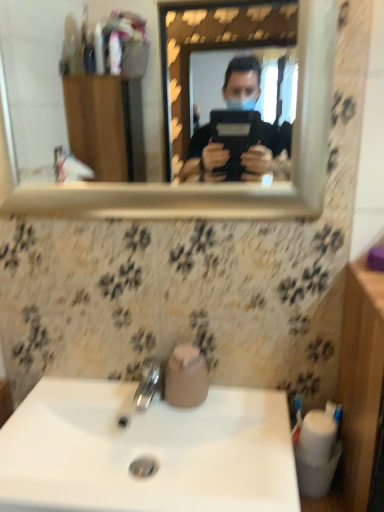
Question: Can you confirm if gold-framed mirror at upper center is smaller than pink matte toilet paper at sink?

Choices:
 (A) yes
 (B) no

Answer: (B)

Question: Can you confirm if gold-framed mirror at upper center is taller than pink matte toilet paper at sink?

Choices:
 (A) yes
 (B) no

Answer: (A)

Question: Is gold-framed mirror at upper center aimed at pink matte toilet paper at sink?

Choices:
 (A) yes
 (B) no

Answer: (B)

Question: From the image's perspective, is gold-framed mirror at upper center beneath pink matte toilet paper at sink?

Choices:
 (A) no
 (B) yes

Answer: (A)

Question: Does gold-framed mirror at upper center have a lesser width compared to pink matte toilet paper at sink?

Choices:
 (A) yes
 (B) no

Answer: (A)

Question: Is polished chrome tap at center in front of or behind gold-framed mirror at upper center in the image?

Choices:
 (A) front
 (B) behind

Answer: (B)

Question: Looking at the image, does polished chrome tap at center seem bigger or smaller compared to gold-framed mirror at upper center?

Choices:
 (A) big
 (B) small

Answer: (B)

Question: Which is correct: polished chrome tap at center is inside gold-framed mirror at upper center, or outside of it?

Choices:
 (A) inside
 (B) outside

Answer: (B)

Question: Based on their positions, is polished chrome tap at center located to the left or right of gold-framed mirror at upper center?

Choices:
 (A) right
 (B) left

Answer: (B)

Question: Considering the positions of point (44, 48) and point (187, 395), is point (44, 48) closer or farther from the camera than point (187, 395)?

Choices:
 (A) closer
 (B) farther

Answer: (B)

Question: Is gold-framed mirror at upper center bigger or smaller than pink matte toilet paper at sink?

Choices:
 (A) small
 (B) big

Answer: (B)

Question: In the image, is gold-framed mirror at upper center on the left side or the right side of pink matte toilet paper at sink?

Choices:
 (A) right
 (B) left

Answer: (B)

Question: From their relative heights in the image, would you say gold-framed mirror at upper center is taller or shorter than pink matte toilet paper at sink?

Choices:
 (A) tall
 (B) short

Answer: (A)

Question: Is white glossy sink at lower center to the left or to the right of polished chrome tap at center in the image?

Choices:
 (A) right
 (B) left

Answer: (A)

Question: From the image's perspective, is white glossy sink at lower center located above or below polished chrome tap at center?

Choices:
 (A) above
 (B) below

Answer: (B)